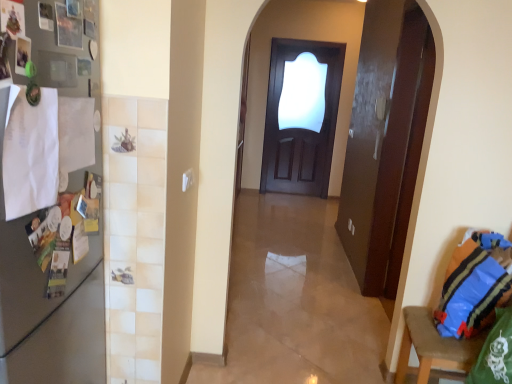
Question: From the image's perspective, relative to blue fabric bag at lower right, is blue striped fabric pillow at right above or below?

Choices:
 (A) above
 (B) below

Answer: (A)

Question: Considering the relative positions of blue striped fabric pillow at right and blue fabric bag at lower right in the image provided, is blue striped fabric pillow at right to the left or to the right of blue fabric bag at lower right?

Choices:
 (A) right
 (B) left

Answer: (A)

Question: Estimate the real-world distances between objects in this image. Which object is closer to the blue striped fabric pillow at right?

Choices:
 (A) dark wood door at center
 (B) blue fabric bag at lower right
 (C) satin silver fridge at left

Answer: (B)

Question: Based on their relative distances, which object is nearer to the dark wood door at center?

Choices:
 (A) blue fabric bag at lower right
 (B) satin silver fridge at left
 (C) blue striped fabric pillow at right

Answer: (A)